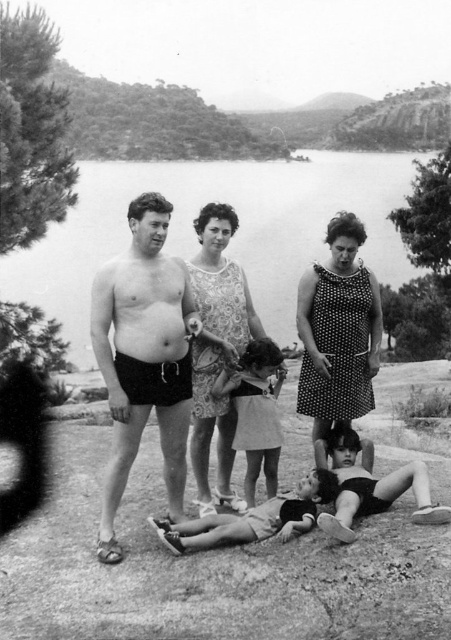
Question: Estimate the real-world distances between objects in this image. Which object is closer to the clear water at center?

Choices:
 (A) black matte shorts at center
 (B) patterned fabric dress at center

Answer: (B)

Question: Is patterned fabric dress at center thinner than smooth skin child at lower center?

Choices:
 (A) yes
 (B) no

Answer: (A)

Question: Does black matte shorts at center have a lesser width compared to black swimsuit girl at lower right?

Choices:
 (A) no
 (B) yes

Answer: (B)

Question: Which of the following is the closest to the observer?

Choices:
 (A) (120, 452)
 (B) (138, 328)

Answer: (B)

Question: Which point is farther from the camera taking this photo?

Choices:
 (A) (220, 536)
 (B) (221, 448)
 (C) (189, 172)

Answer: (C)

Question: Can you confirm if patterned fabric dress at center is smaller than smooth skin child at lower center?

Choices:
 (A) no
 (B) yes

Answer: (B)